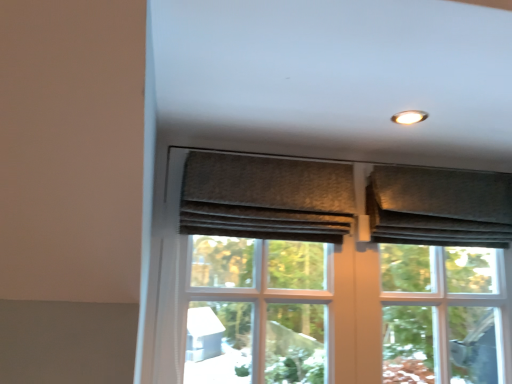
Question: Is textured gray curtain at upper center, which ranks as the second curtain in right-to-left order, at the back of matte brown screen door at center?

Choices:
 (A) yes
 (B) no

Answer: (B)

Question: Does matte brown screen door at center have a smaller size compared to textured gray curtain at upper center, which ranks as the second curtain in right-to-left order?

Choices:
 (A) no
 (B) yes

Answer: (B)

Question: Is matte brown screen door at center positioned before textured gray curtain at upper center, which is the 1th curtain in left-to-right order?

Choices:
 (A) yes
 (B) no

Answer: (B)

Question: Can you confirm if matte brown screen door at center is taller than textured gray curtain at upper center, which is the 1th curtain in left-to-right order?

Choices:
 (A) yes
 (B) no

Answer: (A)

Question: Can you confirm if matte brown screen door at center is thinner than textured gray curtain at upper center, which is the 1th curtain in left-to-right order?

Choices:
 (A) no
 (B) yes

Answer: (B)

Question: Considering the positions of textured gray curtain at upper right, the 1th curtain when ordered from right to left, and textured gray fabric at upper right in the image, is textured gray curtain at upper right, the 1th curtain when ordered from right to left, bigger or smaller than textured gray fabric at upper right?

Choices:
 (A) big
 (B) small

Answer: (B)

Question: Is point (380, 221) closer or farther from the camera than point (407, 370)?

Choices:
 (A) farther
 (B) closer

Answer: (B)

Question: Which is correct: textured gray curtain at upper right, the 1th curtain when ordered from right to left, is inside textured gray fabric at upper right, or outside of it?

Choices:
 (A) inside
 (B) outside

Answer: (A)

Question: In the image, is textured gray curtain at upper right, the 1th curtain when ordered from right to left, on the left side or the right side of textured gray fabric at upper right?

Choices:
 (A) left
 (B) right

Answer: (B)

Question: From a real-world perspective, is matte brown screen door at center positioned above or below textured gray curtain at upper right, the 1th curtain when ordered from right to left?

Choices:
 (A) below
 (B) above

Answer: (A)

Question: Which is correct: matte brown screen door at center is inside textured gray curtain at upper right, the 2th curtain viewed from the left, or outside of it?

Choices:
 (A) inside
 (B) outside

Answer: (B)

Question: From the image's perspective, is matte brown screen door at center positioned above or below textured gray curtain at upper right, the 1th curtain when ordered from right to left?

Choices:
 (A) above
 (B) below

Answer: (B)

Question: Looking at their shapes, would you say matte brown screen door at center is wider or thinner than textured gray curtain at upper right, the 1th curtain when ordered from right to left?

Choices:
 (A) wide
 (B) thin

Answer: (B)

Question: From a real-world perspective, is matte brown screen door at center above or below textured gray fabric at upper right?

Choices:
 (A) above
 (B) below

Answer: (B)

Question: From their relative heights in the image, would you say matte brown screen door at center is taller or shorter than textured gray fabric at upper right?

Choices:
 (A) tall
 (B) short

Answer: (B)